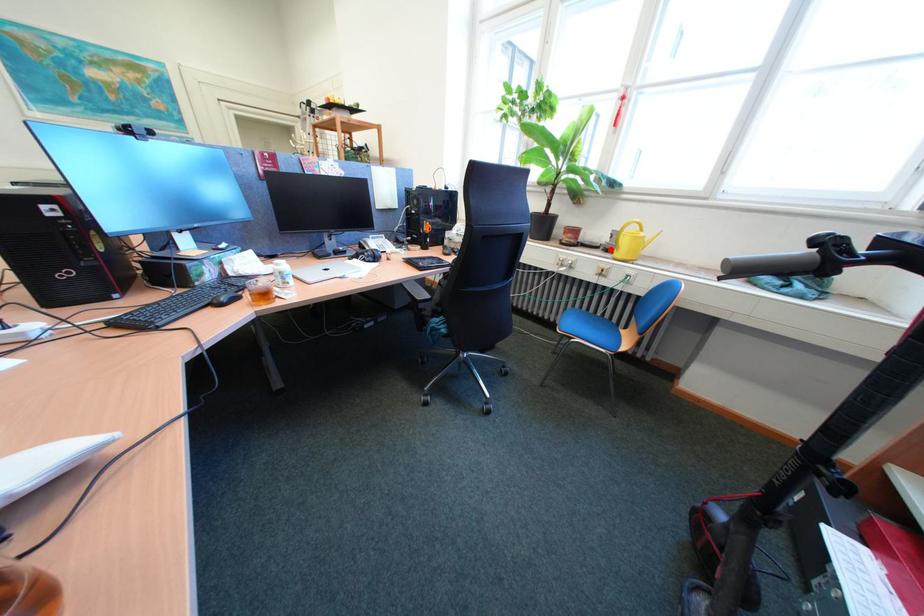
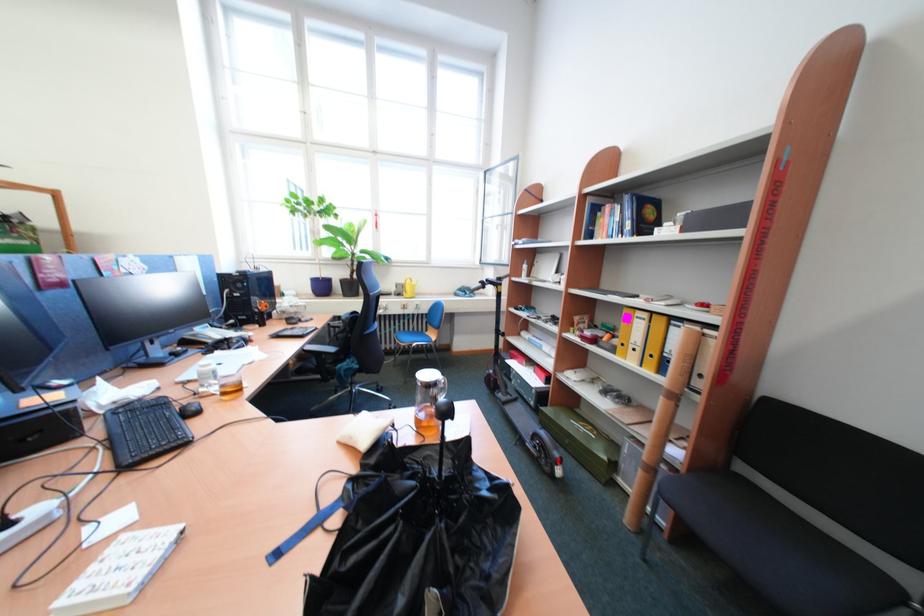
The point at the highlighted location is marked in the first image. Where is the corresponding point in the second image?

(403, 296)